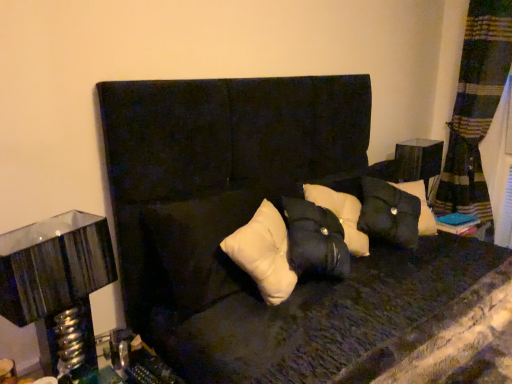
Question: From the image's perspective, is metallic silver table lamp at left located above or below white matte pillow at center?

Choices:
 (A) above
 (B) below

Answer: (B)

Question: In terms of width, does metallic silver table lamp at left look wider or thinner when compared to white matte pillow at center?

Choices:
 (A) wide
 (B) thin

Answer: (B)

Question: Which is nearer to the white matte pillow at center?

Choices:
 (A) velvet black couch at center
 (B) matte black side table at right
 (C) metallic silver table lamp at left

Answer: (A)

Question: Which of these objects is positioned farthest from the velvet black couch at center?

Choices:
 (A) metallic silver table lamp at left
 (B) matte black side table at right
 (C) white matte pillow at center

Answer: (B)